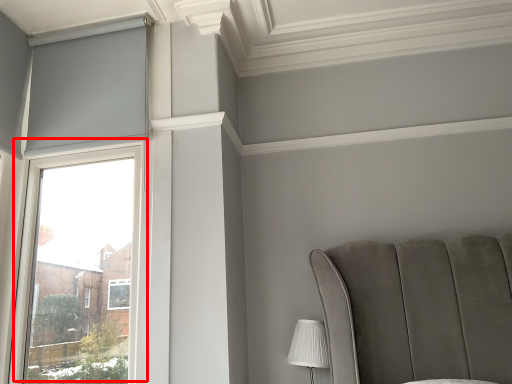
Question: Observing the image, what is the correct spatial positioning of window (annotated by the red box) in reference to table lamp?

Choices:
 (A) right
 (B) left

Answer: (B)